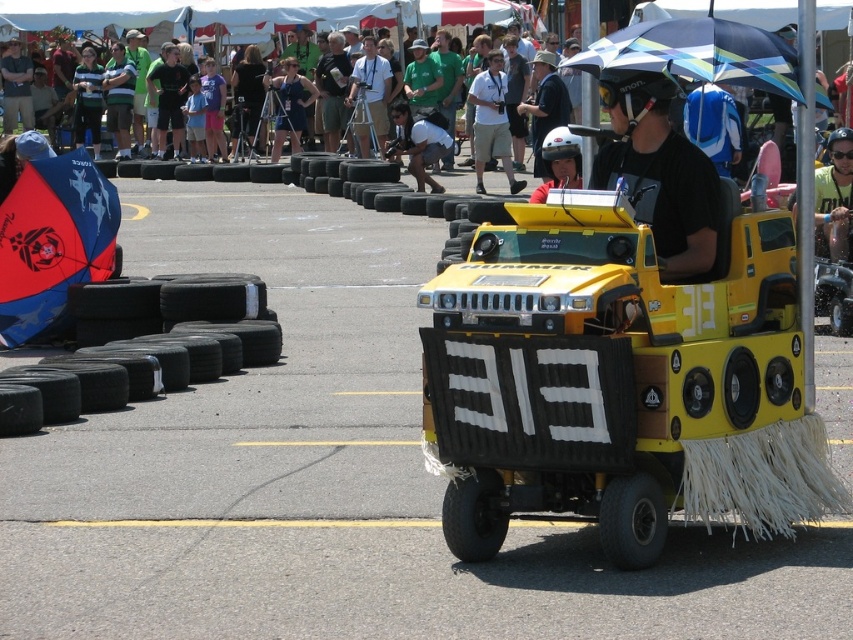
What are the coordinates of the yellow matte hummer at center in the image?

The coordinates of the yellow matte hummer at center are at point (618, 381).

You are a photographer at the car race event and want to capture both the yellow matte hummer at center and the white matte helmet at center in a single photo. Based on their positions, which object should you focus on first to ensure both are in frame?

The yellow matte hummer at center is located below the white matte helmet at center, so you should focus on the white matte helmet at center first to ensure both are in the frame.

You are a photographer at the car race event. You want to take a photo that includes both the blue fabric umbrella at left and the blue denim shirt at center. The camera you are using has a maximum focus range of 15 meters. Can you capture both objects in the same photo without moving the camera?

The distance between the blue fabric umbrella at left and the blue denim shirt at center is 14.26 meters, which is within the camera maximum focus range of 15 meters. Therefore, you can capture both objects in the same photo without moving the camera.